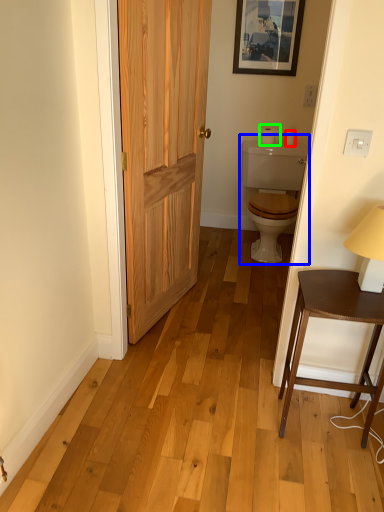
Question: Which object is positioned farthest from toilet paper (highlighted by a red box)? Select from sink (highlighted by a blue box) and toilet paper (highlighted by a green box).

Choices:
 (A) sink
 (B) toilet paper

Answer: (A)